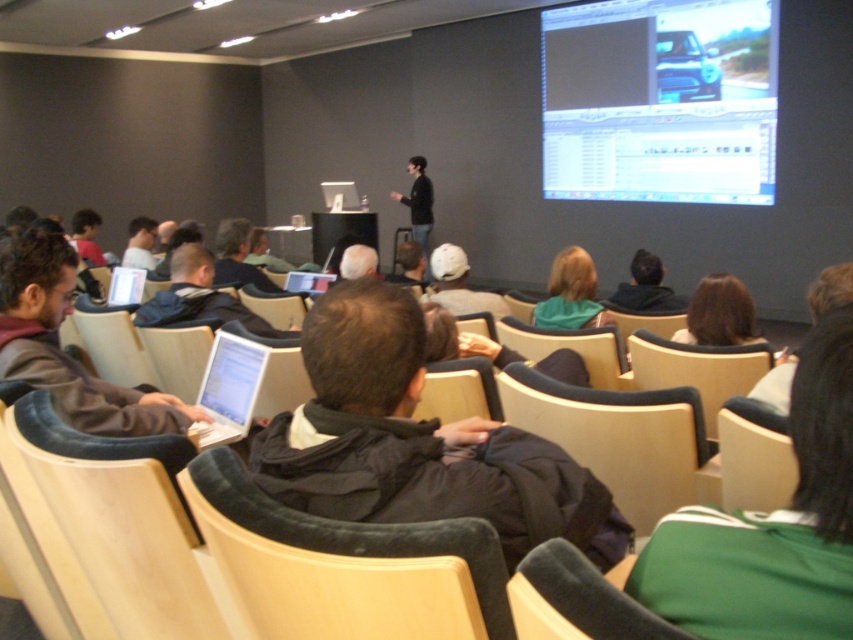
You are organizing a seating arrangement for a presentation and need to place a tall plant next to the velvet green chair at lower right and the green fabric jacket at center. Given their heights, which object should the plant be placed next to to ensure it doesn

The velvet green chair at lower right is not as tall as the green fabric jacket at center, so the tall plant should be placed next to the green fabric jacket at center to create a balanced appearance.